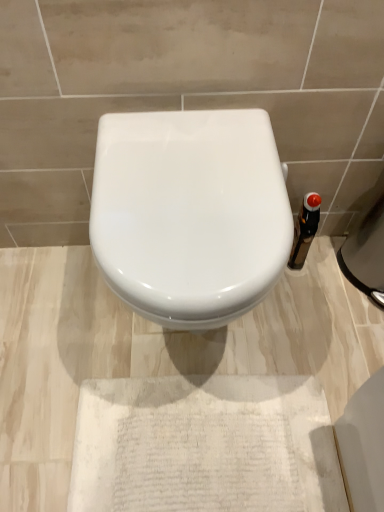
You are a GUI agent. You are given a task and a screenshot of the screen. Output one action in this format:
    pyautogui.click(x=<x>, y=<y>)
    Task: Click on the vacant area located to the right-hand side of black glass bottle at right
    
    Given the screenshot: What is the action you would take?
    pyautogui.click(x=333, y=268)